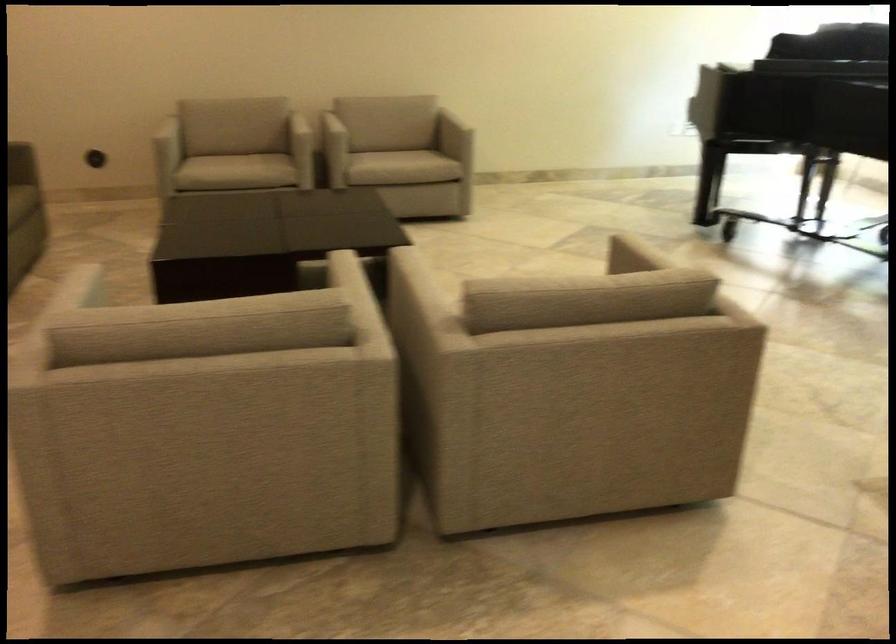
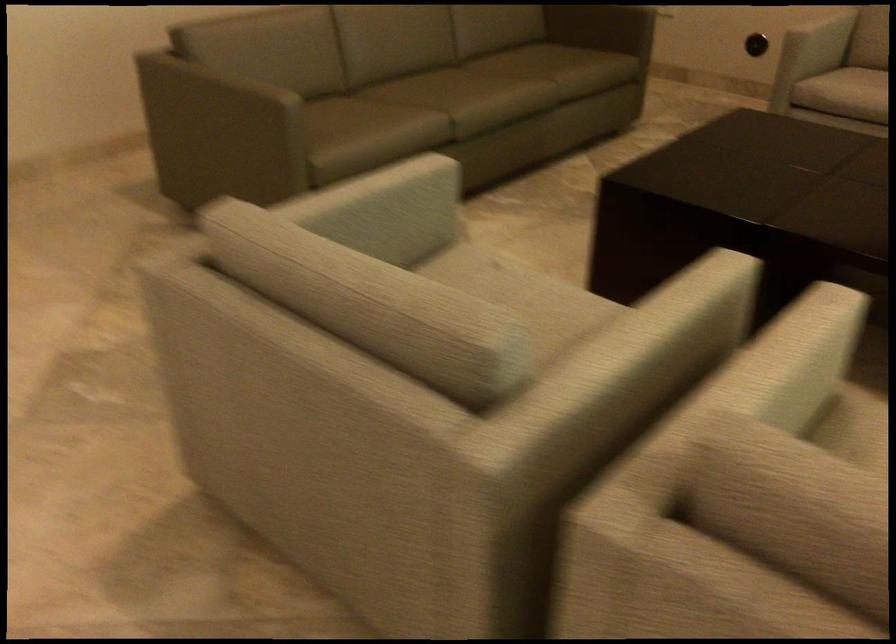
Where in the second image is the point corresponding to pixel 355 289 from the first image?

(659, 332)